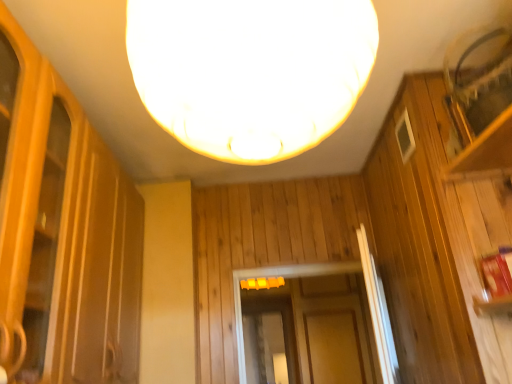
Question: In the image, is transparent glass screen door at center positioned in front of or behind white matte lampshade at center?

Choices:
 (A) behind
 (B) front

Answer: (A)

Question: Considering the positions of transparent glass screen door at center and white matte lampshade at center in the image, is transparent glass screen door at center wider or thinner than white matte lampshade at center?

Choices:
 (A) wide
 (B) thin

Answer: (B)

Question: From a real-world perspective, is transparent glass screen door at center physically located above or below white matte lampshade at center?

Choices:
 (A) above
 (B) below

Answer: (B)

Question: In terms of width, does white matte lampshade at center look wider or thinner when compared to transparent glass screen door at center?

Choices:
 (A) wide
 (B) thin

Answer: (A)

Question: Considering the positions of point (304, 49) and point (244, 301), is point (304, 49) closer or farther from the camera than point (244, 301)?

Choices:
 (A) closer
 (B) farther

Answer: (A)

Question: In the image, is white matte lampshade at center on the left side or the right side of transparent glass screen door at center?

Choices:
 (A) left
 (B) right

Answer: (A)

Question: Considering the positions of white matte lampshade at center and transparent glass screen door at center in the image, is white matte lampshade at center taller or shorter than transparent glass screen door at center?

Choices:
 (A) short
 (B) tall

Answer: (A)